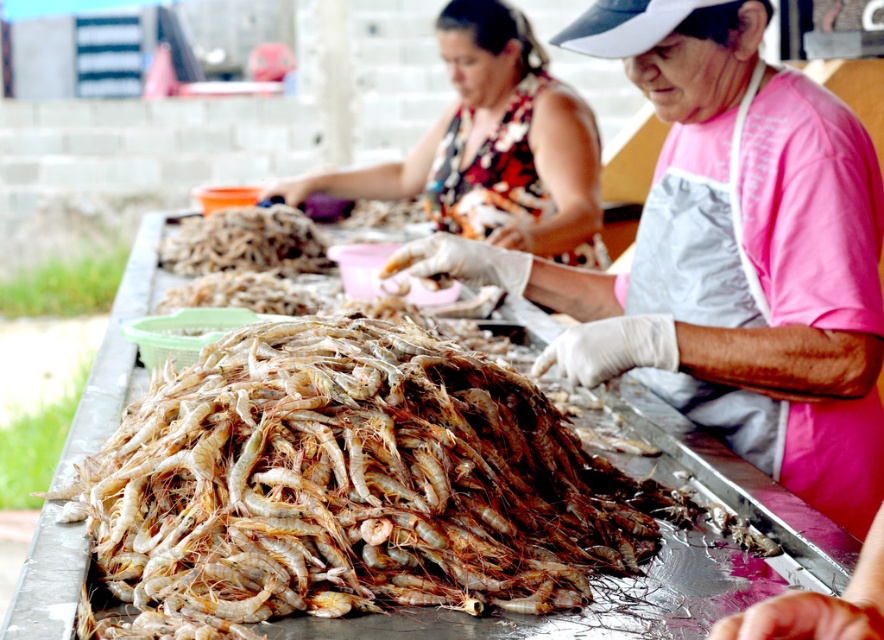
Which is below, translucent white shrimp at center or pink fabric apron at center?

translucent white shrimp at center is lower down.

Is point (503, 593) positioned in front of point (661, 221)?

That is True.

Which is in front, point (436, 596) or point (829, 168)?

Positioned in front is point (436, 596).

The image size is (884, 640). I want to click on translucent white shrimp at center, so click(x=349, y=486).

Can you confirm if translucent white shrimp at center is taller than translucent plastic tray at center?

Indeed, translucent white shrimp at center has a greater height compared to translucent plastic tray at center.

Is translucent white shrimp at center smaller than translucent plastic tray at center?

No, translucent white shrimp at center is not smaller than translucent plastic tray at center.

Which is in front, point (408, 413) or point (223, 257)?

Point (408, 413)

What are the coordinates of `translucent white shrimp at center` in the screenshot? It's located at (x=349, y=486).

From the picture: Can you confirm if pink fabric apron at center is taller than printed fabric blouse at upper center?

Correct, pink fabric apron at center is much taller as printed fabric blouse at upper center.

Is pink fabric apron at center to the right of printed fabric blouse at upper center from the viewer's perspective?

Correct, you'll find pink fabric apron at center to the right of printed fabric blouse at upper center.

Find the location of a particular element. The image size is (884, 640). pink fabric apron at center is located at coordinates (730, 253).